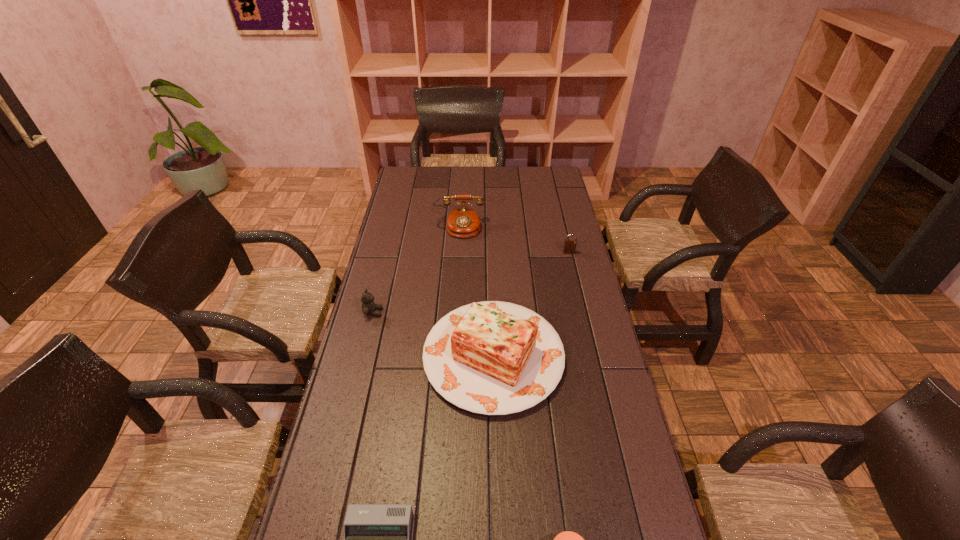
Image resolution: width=960 pixels, height=540 pixels. I want to click on vacant area that lies between the lasagna and the second farthest object, so click(531, 304).

In order to click on object that stands as the second closest to the farthest object in this screenshot , I will do `click(494, 358)`.

Identify the location of object that is the second closest to the jam. This screenshot has width=960, height=540. (376, 536).

Identify the location of vacant space that satisfies the following two spatial constraints: 1. on the front-facing side of the fifth nearest object; 2. on the face of the teddy bear. This screenshot has width=960, height=540. (583, 312).

The image size is (960, 540). What are the coordinates of `free space that satisfies the following two spatial constraints: 1. on the dial of the telephone; 2. on the right side of the lasagna` in the screenshot? It's located at (451, 356).

The height and width of the screenshot is (540, 960). In order to click on vacant area in the image that satisfies the following two spatial constraints: 1. on the dial of the telephone; 2. on the face of the teddy bear in this screenshot , I will do `click(454, 312)`.